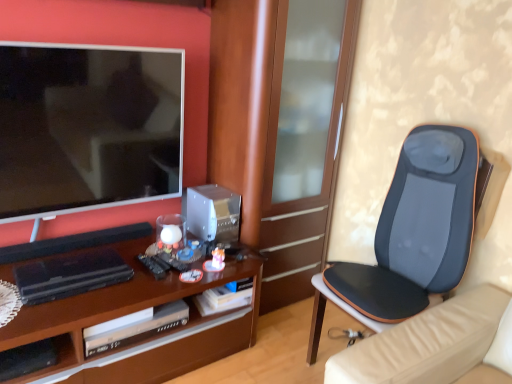
Question: Is matte black tv at left taller or shorter than brown wood desk at center?

Choices:
 (A) tall
 (B) short

Answer: (A)

Question: Looking at the image, does matte black tv at left seem bigger or smaller compared to brown wood desk at center?

Choices:
 (A) big
 (B) small

Answer: (B)

Question: Which is nearer to the matte black tv at left?

Choices:
 (A) black mesh cushion at right
 (B) black plastic shelf at lower left
 (C) brown wood desk at center
 (D) brown wood cabinet at center

Answer: (C)

Question: Considering the real-world distances, which object is closest to the brown wood cabinet at center?

Choices:
 (A) black mesh cushion at right
 (B) black plastic shelf at lower left
 (C) matte black tv at left
 (D) brown wood desk at center

Answer: (C)